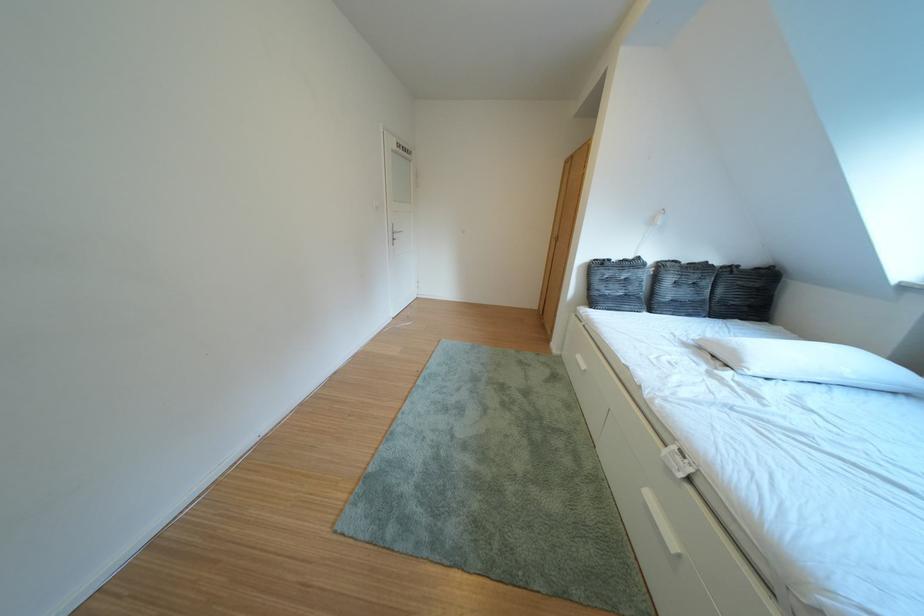
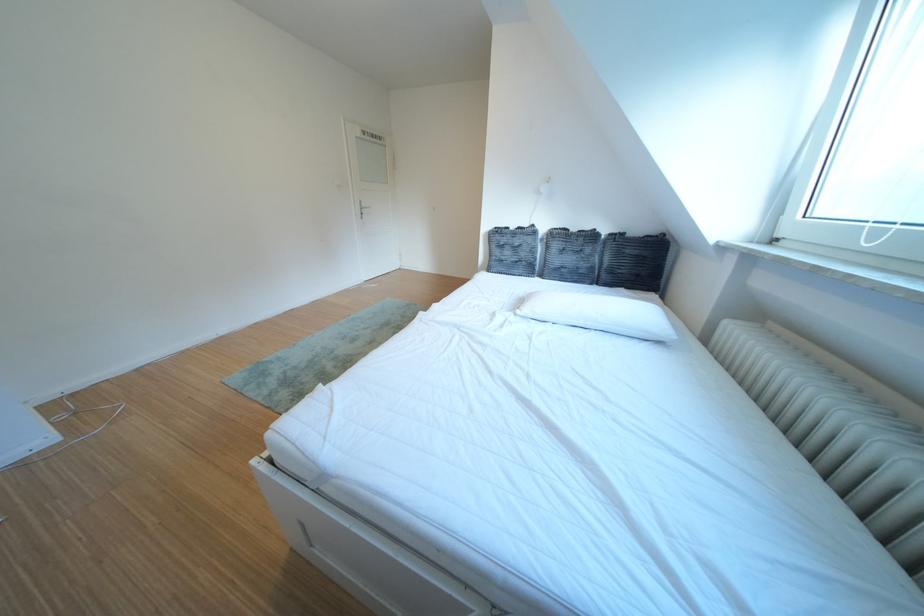
Where in the second image is the point corresponding to point (770, 371) from the first image?

(540, 314)